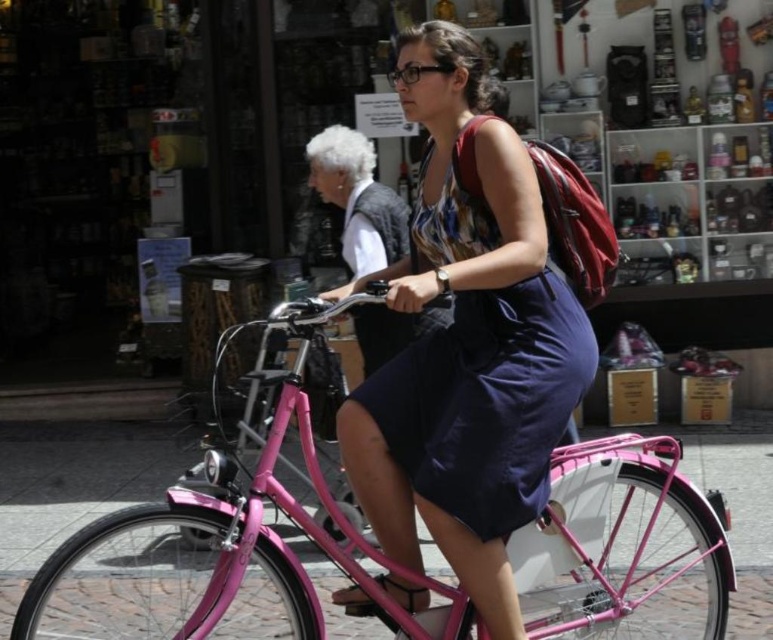
Question: Is pink metallic bicycle at center to the left of navy blue fabric dress at center from the viewer's perspective?

Choices:
 (A) yes
 (B) no

Answer: (B)

Question: Among these objects, which one is nearest to the camera?

Choices:
 (A) pink metallic bicycle at center
 (B) navy blue fabric dress at center

Answer: (A)

Question: Is pink metallic bicycle at center in front of navy blue fabric dress at center?

Choices:
 (A) yes
 (B) no

Answer: (A)

Question: Is pink metallic bicycle at center positioned in front of navy blue fabric dress at center?

Choices:
 (A) no
 (B) yes

Answer: (B)

Question: Among these objects, which one is farthest from the camera?

Choices:
 (A) navy blue fabric dress at center
 (B) pink metallic bicycle at center

Answer: (A)